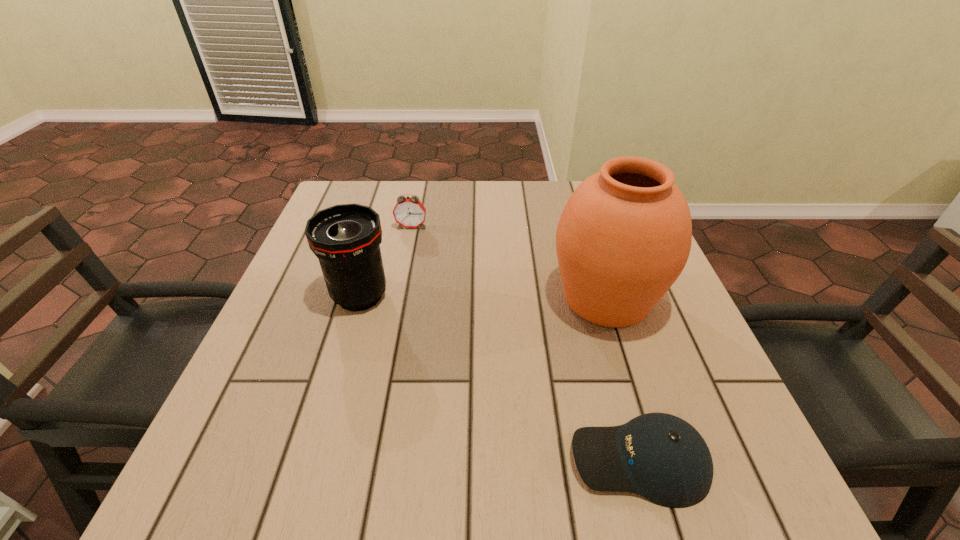
The image size is (960, 540). What are the coordinates of `vacant area between the farthest object and the baseball cap` in the screenshot? It's located at (525, 343).

Find the location of a particular element. The image size is (960, 540). free space between the second tallest object and the urn is located at coordinates (483, 297).

This screenshot has width=960, height=540. In order to click on object that is the third closest to the third shortest object in this screenshot , I will do 659,456.

Locate an element on the screen. The height and width of the screenshot is (540, 960). object that is the third nearest to the second shortest object is located at coordinates (659, 456).

You are a GUI agent. You are given a task and a screenshot of the screen. Output one action in this format:
    pyautogui.click(x=<x>, y=<y>)
    Task: Click on the free location that satisfies the following two spatial constraints: 1. on the clock face of the alarm clock; 2. on the right side of the tallest object
    This screenshot has width=960, height=540.
    Given the screenshot: What is the action you would take?
    pyautogui.click(x=397, y=298)

Identify the location of vacant position in the image that satisfies the following two spatial constraints: 1. on the clock face of the urn; 2. on the right side of the alarm clock. (397, 298).

The height and width of the screenshot is (540, 960). What are the coordinates of `vacant space that satisfies the following two spatial constraints: 1. on the front side of the tallest object; 2. on the left side of the second tallest object` in the screenshot? It's located at pyautogui.click(x=359, y=298).

The height and width of the screenshot is (540, 960). Identify the location of vacant space that satisfies the following two spatial constraints: 1. on the front side of the tallest object; 2. on the left side of the telephoto lens. (359, 298).